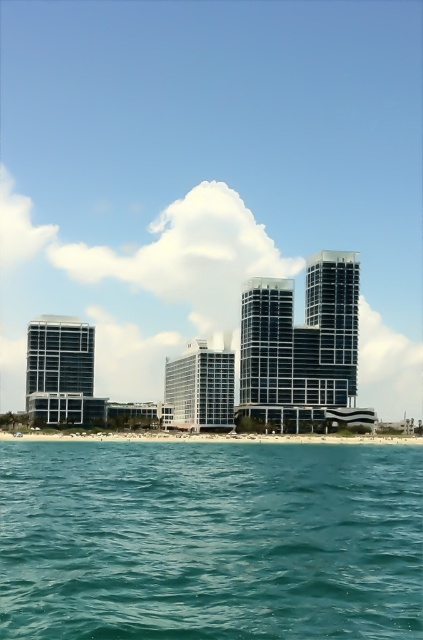
Question: Is teal glossy water at lower center positioned behind white sand beach at lower center?

Choices:
 (A) no
 (B) yes

Answer: (A)

Question: Which point appears closest to the camera in this image?

Choices:
 (A) (41, 452)
 (B) (153, 438)

Answer: (A)

Question: Is teal glossy water at lower center smaller than white sand beach at lower center?

Choices:
 (A) no
 (B) yes

Answer: (A)

Question: Which point is farther from the camera taking this photo?

Choices:
 (A) (167, 605)
 (B) (419, 436)

Answer: (B)

Question: Does teal glossy water at lower center come in front of white sand beach at lower center?

Choices:
 (A) yes
 (B) no

Answer: (A)